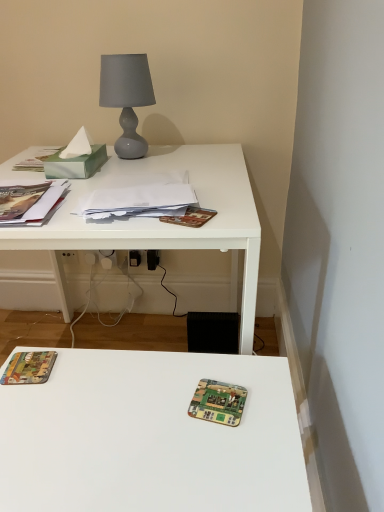
This screenshot has height=512, width=384. Find the location of `vacant area that is situated to the right of matte gray glass lamp at upper center`. vacant area that is situated to the right of matte gray glass lamp at upper center is located at coordinates (182, 151).